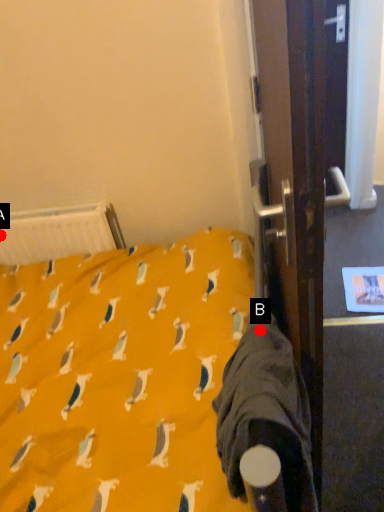
Question: Two points are circled on the image, labeled by A and B beside each circle. Which point is farther to the camera?

Choices:
 (A) A is further
 (B) B is further

Answer: (A)